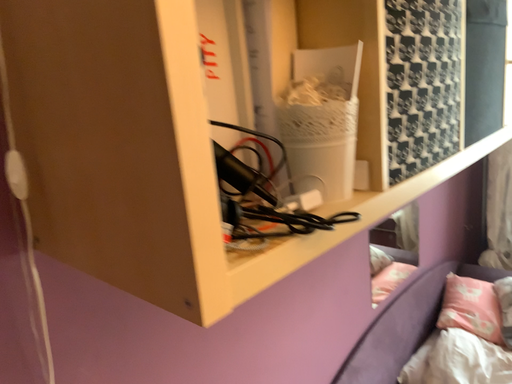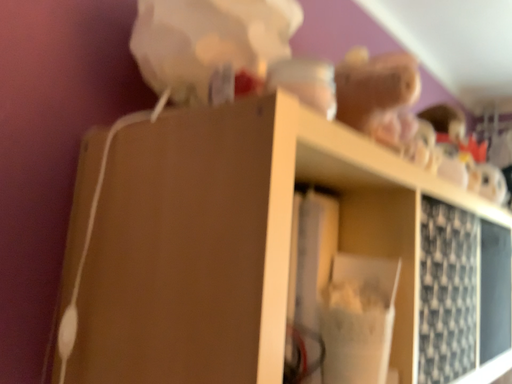
Question: Which way did the camera rotate in the video?

Choices:
 (A) rotated upward
 (B) rotated downward

Answer: (A)